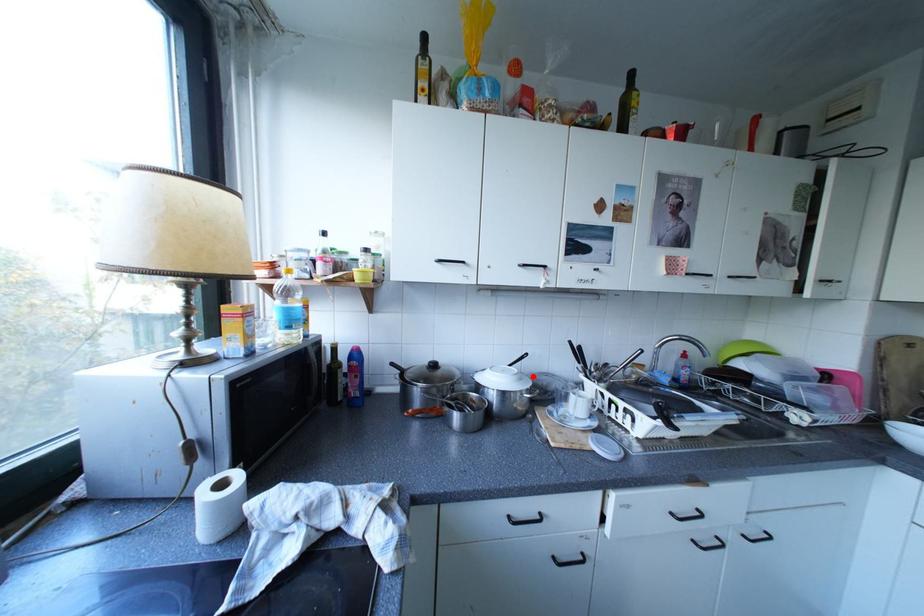
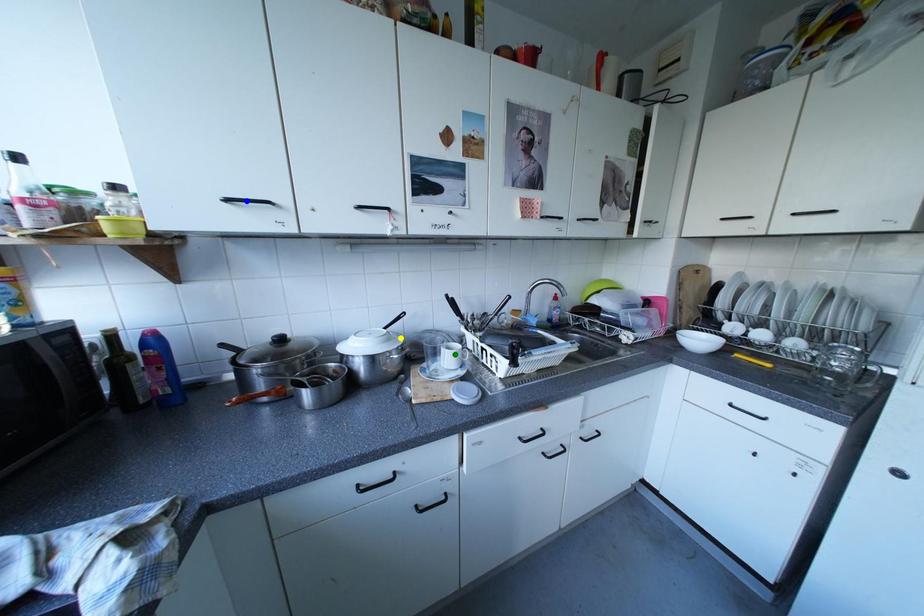
Question: I am providing you with two images of the same scene from different viewpoints. A red point is marked on the first image. You are given multiple points on the second image. Which spot in image 2 lines up with the point in image 1?

Choices:
 (A) yellow point
 (B) green point
 (C) blue point

Answer: (A)